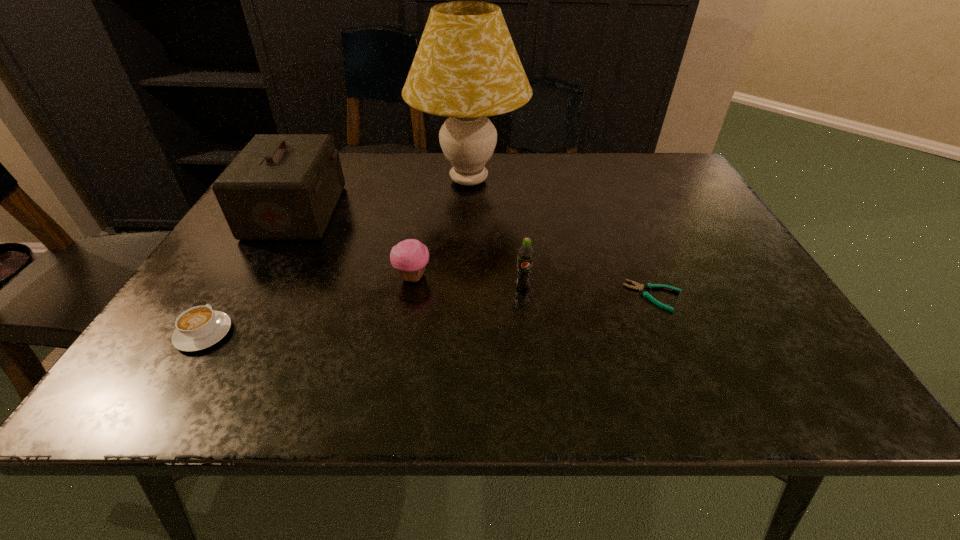
Locate an element on the screen. The image size is (960, 540). vacant space located 0.140m on the front label of the soda is located at coordinates (530, 347).

Where is `vacant space located 0.220m on the right of the cupcake`? vacant space located 0.220m on the right of the cupcake is located at coordinates (536, 278).

Locate an element on the screen. free region located 0.250m on the side of the nearest object with the handle is located at coordinates (263, 236).

I want to click on blank space located on the side of the nearest object with the handle, so click(x=260, y=241).

This screenshot has width=960, height=540. In order to click on vacant region located on the side of the nearest object with the handle in this screenshot , I will do `click(268, 228)`.

Locate an element on the screen. The image size is (960, 540). vacant position located 0.360m on the back of the rightmost object is located at coordinates (611, 190).

Where is `lampshade that is at the far edge`? This screenshot has width=960, height=540. lampshade that is at the far edge is located at coordinates coord(466,67).

You are a GUI agent. You are given a task and a screenshot of the screen. Output one action in this format:
    pyautogui.click(x=<x>, y=<y>)
    Task: Click on the first-aid kit located at the far edge
    The width and height of the screenshot is (960, 540).
    Given the screenshot: What is the action you would take?
    pyautogui.click(x=280, y=186)

The width and height of the screenshot is (960, 540). Identify the location of the first-aid kit located in the left edge section of the desktop. (280, 186).

Image resolution: width=960 pixels, height=540 pixels. In order to click on cappuccino that is at the left edge in this screenshot , I will do `click(197, 328)`.